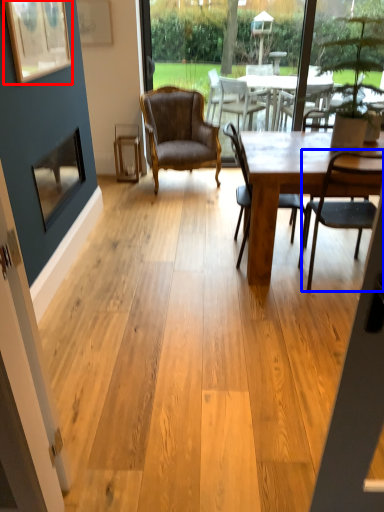
Question: Among these objects, which one is nearest to the camera, picture frame (highlighted by a red box) or chair (highlighted by a blue box)?

Choices:
 (A) picture frame
 (B) chair

Answer: (A)